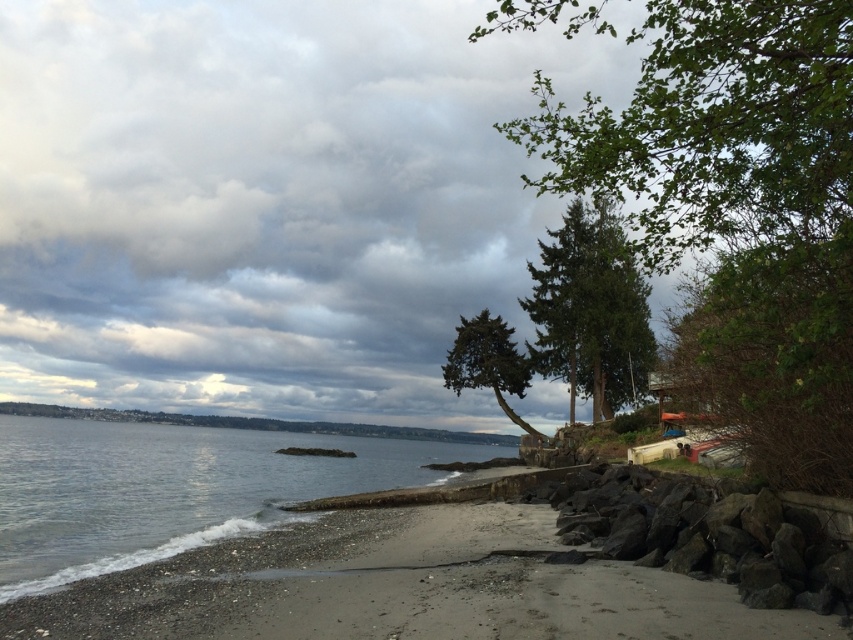
From the picture: Who is shorter, green leafy tree at right or black rock at lower right?

black rock at lower right is shorter.

This screenshot has width=853, height=640. Identify the location of green leafy tree at right. (776, 356).

Locate an element on the screen. Image resolution: width=853 pixels, height=640 pixels. green leafy tree at right is located at coordinates (776, 356).

Does green leafy tree at right lie behind green textured tree at center?

No, green leafy tree at right is closer to the viewer.

Is green leafy tree at right bigger than green textured tree at center?

No.

Is point (697, 396) farther from camera compared to point (490, 323)?

No.

Where is `green leafy tree at right`? green leafy tree at right is located at coordinates (776, 356).

Does point (524, 16) come farther from viewer compared to point (732, 518)?

Yes, it is.

Based on the photo, which is below, green leafy tree at center or black rock at lower right?

black rock at lower right

This screenshot has height=640, width=853. What are the coordinates of `green leafy tree at center` in the screenshot? It's located at (740, 209).